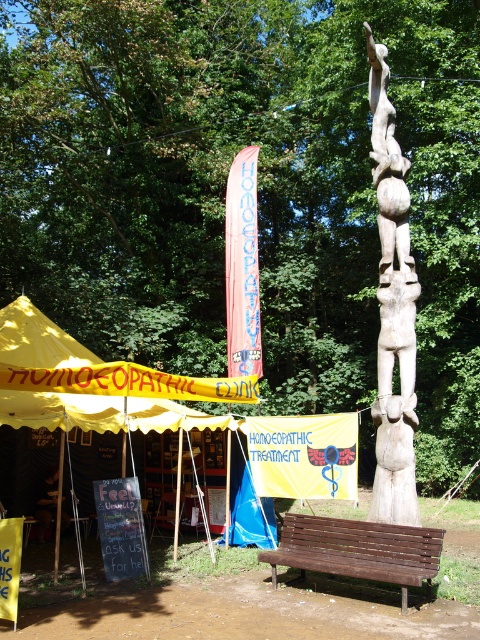
Question: Which point is farther to the camera?

Choices:
 (A) yellow fabric tent at lower left
 (B) dark brown wooden sign at lower left

Answer: (B)

Question: Which point appears farthest from the camera in this image?

Choices:
 (A) (399, 442)
 (B) (303, 472)

Answer: (B)

Question: Which of the following is the closest to the observer?

Choices:
 (A) click(x=83, y=365)
 (B) click(x=383, y=548)
 (C) click(x=48, y=468)
 (D) click(x=397, y=195)

Answer: (B)

Question: Is yellow fabric tent at lower left wider than brown wooden bench at lower center?

Choices:
 (A) yes
 (B) no

Answer: (A)

Question: Does yellow fabric tent at lower left have a smaller size compared to brown wooden bench at lower center?

Choices:
 (A) yes
 (B) no

Answer: (B)

Question: Is wooden statue at center bigger than brown wooden bench at lower center?

Choices:
 (A) yes
 (B) no

Answer: (B)